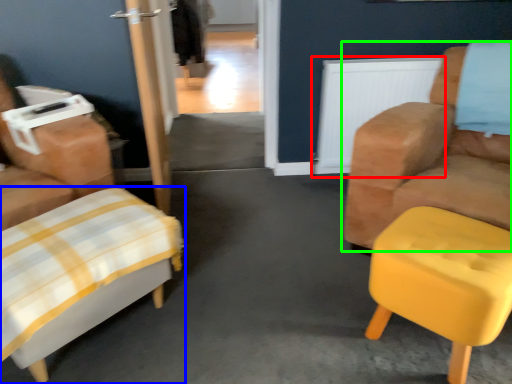
Question: Which object is the closest to the radiator (highlighted by a red box)? Choose among these: furniture (highlighted by a blue box) or chair (highlighted by a green box).

Choices:
 (A) furniture
 (B) chair

Answer: (B)